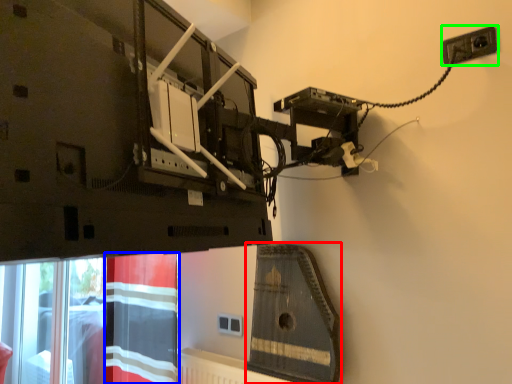
Question: Estimate the real-world distances between objects in this image. Which object is farther from instrument (highlighted by a red box), curtain (highlighted by a blue box) or power plugs and sockets (highlighted by a green box)?

Choices:
 (A) curtain
 (B) power plugs and sockets

Answer: (B)